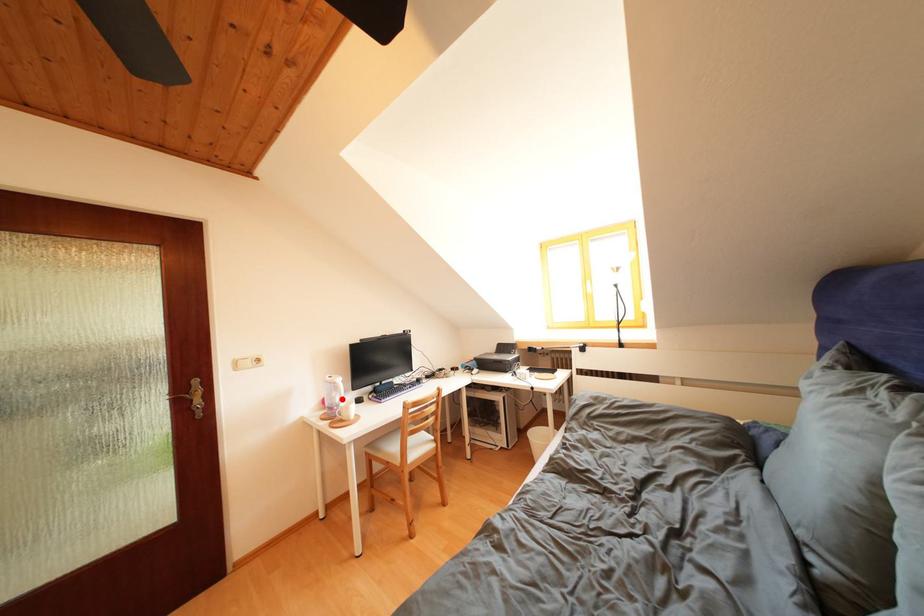
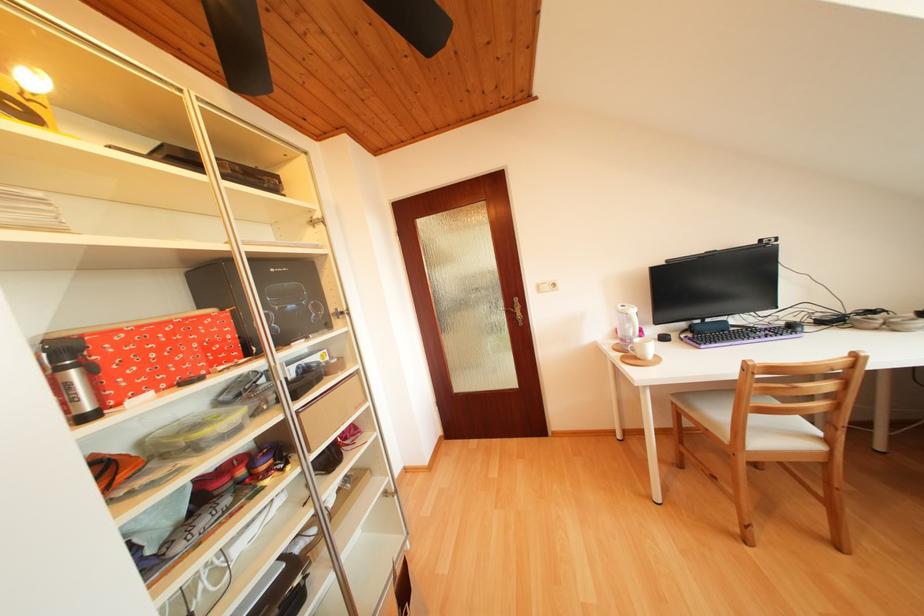
Locate, in the second image, the point that corresponds to the highlighted location in the first image.

(636, 331)